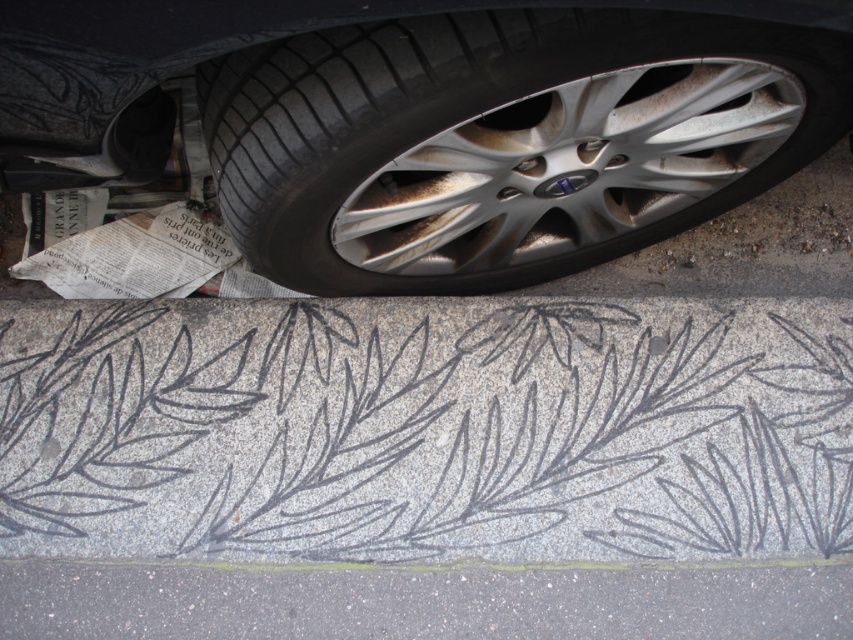
Can you confirm if gray asphalt at lower center is positioned to the left of granite curb at lower center?

Indeed, gray asphalt at lower center is positioned on the left side of granite curb at lower center.

Is point (54, 566) farther from camera compared to point (165, 563)?

Yes, point (54, 566) is farther from viewer.

Find the location of `gray asphalt at lower center`. gray asphalt at lower center is located at coordinates (421, 602).

Consider the image. Who is positioned more to the right, silver metallic wheel at center or gray asphalt at lower center?

Positioned to the right is silver metallic wheel at center.

From the picture: Between silver metallic wheel at center and gray asphalt at lower center, which one has more height?

With more height is silver metallic wheel at center.

Is point (508, 205) positioned after point (808, 627)?

That is True.

You are a GUI agent. You are given a task and a screenshot of the screen. Output one action in this format:
    pyautogui.click(x=<x>, y=<y>)
    Task: Click on the silver metallic wheel at center
    This screenshot has width=853, height=640.
    Given the screenshot: What is the action you would take?
    pyautogui.click(x=505, y=140)

Does silver metallic wheel at center appear on the left side of granite curb at lower center?

In fact, silver metallic wheel at center is to the right of granite curb at lower center.

Is silver metallic wheel at center taller than granite curb at lower center?

Yes.

Which is in front, point (270, 125) or point (129, 564)?

Point (270, 125) is in front.

Image resolution: width=853 pixels, height=640 pixels. In order to click on silver metallic wheel at center in this screenshot , I will do `click(505, 140)`.